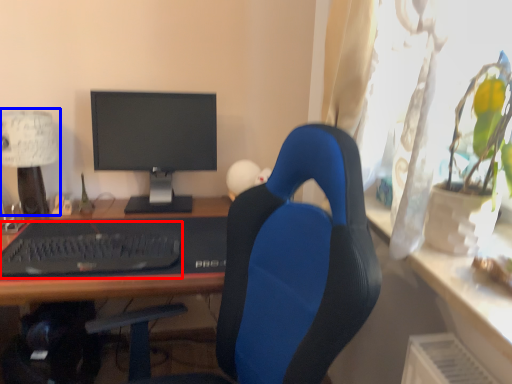
Question: Which object is closer to the camera taking this photo, laptop keyboard (highlighted by a red box) or table lamp (highlighted by a blue box)?

Choices:
 (A) laptop keyboard
 (B) table lamp

Answer: (A)